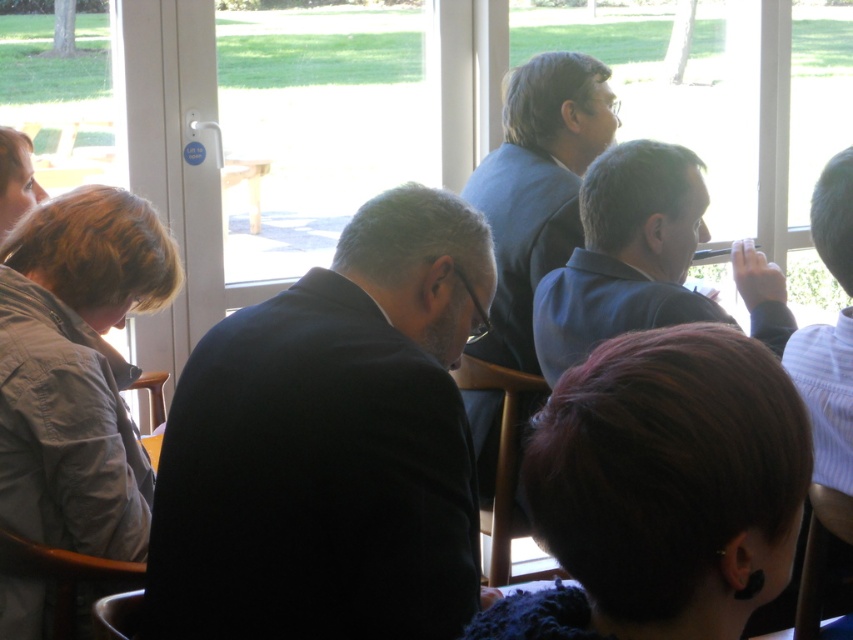
Who is lower down, blue fabric shirt at right or white striped shirt at right?

white striped shirt at right

Is blue fabric shirt at right to the right of white striped shirt at right from the viewer's perspective?

No, blue fabric shirt at right is not to the right of white striped shirt at right.

The width and height of the screenshot is (853, 640). Describe the element at coordinates (625, 253) in the screenshot. I see `blue fabric shirt at right` at that location.

Where is `blue fabric shirt at right`? This screenshot has height=640, width=853. blue fabric shirt at right is located at coordinates (625, 253).

Is dark brown hair at lower right below white striped shirt at right?

Yes.

Who is shorter, dark brown hair at lower right or white striped shirt at right?

With less height is dark brown hair at lower right.

Identify the location of dark brown hair at lower right. (662, 490).

At what (x,y) coordinates should I click in order to perform the action: click on dark brown hair at lower right. Please return your answer as a coordinate pair (x, y). This screenshot has width=853, height=640. Looking at the image, I should click on (662, 490).

Between point (354, 406) and point (647, 280), which one is positioned behind?

The point (647, 280) is behind.

Is dark suit at center taller than blue fabric shirt at right?

Yes, dark suit at center is taller than blue fabric shirt at right.

This screenshot has height=640, width=853. I want to click on dark suit at center, so click(x=329, y=445).